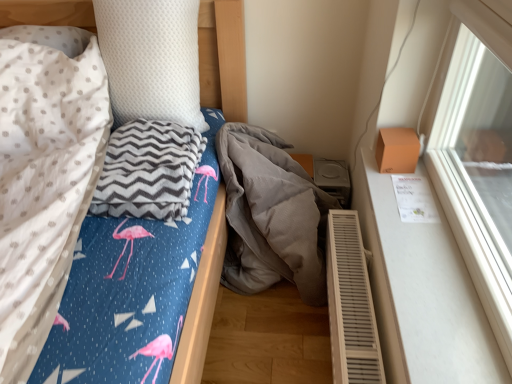
Question: From the image's perspective, is white matte window sill at right located above or below gray chevron blanket at left, which ranks as the 1th material in left-to-right order?

Choices:
 (A) above
 (B) below

Answer: (B)

Question: Considering the positions of white matte window sill at right and gray chevron blanket at left, which ranks as the 1th material in left-to-right order, in the image, is white matte window sill at right bigger or smaller than gray chevron blanket at left, which ranks as the 1th material in left-to-right order,?

Choices:
 (A) small
 (B) big

Answer: (A)

Question: Estimate the real-world distances between objects in this image. Which object is farther from the white matte window sill at right?

Choices:
 (A) white plastic air conditioner at lower right
 (B) white dotted pillow at upper left
 (C) gray corduroy blanket at center, the 1th material viewed from the right
 (D) gray chevron blanket at left, which is the 2th material from right to left

Answer: (B)

Question: Which of these objects is positioned closest to the white matte window sill at right?

Choices:
 (A) white plastic air conditioner at lower right
 (B) gray chevron blanket at left, which is the 2th material from right to left
 (C) white dotted pillow at upper left
 (D) gray corduroy blanket at center, which is counted as the 2th material, starting from the left

Answer: (A)